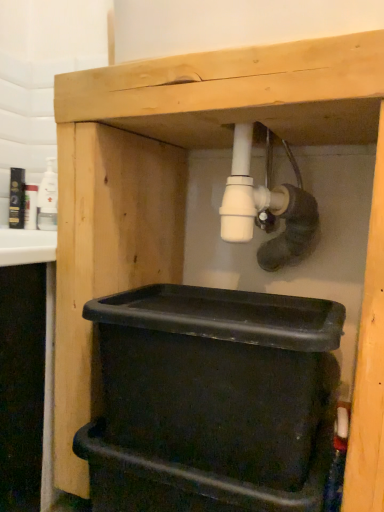
Question: Can you see black plastic bin at lower center touching white glossy bottle at upper left?

Choices:
 (A) no
 (B) yes

Answer: (A)

Question: Is black plastic bin at lower center outside white glossy bottle at upper left?

Choices:
 (A) yes
 (B) no

Answer: (A)

Question: Considering the relative sizes of black plastic bin at lower center and white glossy bottle at upper left in the image provided, is black plastic bin at lower center taller than white glossy bottle at upper left?

Choices:
 (A) no
 (B) yes

Answer: (B)

Question: Is white glossy bottle at upper left at the back of black plastic bin at lower center?

Choices:
 (A) no
 (B) yes

Answer: (A)

Question: Would you consider black plastic bin at lower center to be distant from white glossy bottle at upper left?

Choices:
 (A) no
 (B) yes

Answer: (B)

Question: Is black plastic bin at lower center wider than white glossy bottle at upper left?

Choices:
 (A) no
 (B) yes

Answer: (B)

Question: Is white glossy bottle at upper left surrounding black plastic bin at lower center?

Choices:
 (A) yes
 (B) no

Answer: (B)

Question: From the image's perspective, is white glossy bottle at upper left under black plastic bin at lower center?

Choices:
 (A) yes
 (B) no

Answer: (B)

Question: Is white glossy bottle at upper left closer to the viewer compared to black plastic bin at lower center?

Choices:
 (A) no
 (B) yes

Answer: (A)

Question: Can you confirm if white glossy bottle at upper left is thinner than black plastic bin at lower center?

Choices:
 (A) no
 (B) yes

Answer: (B)

Question: Is white glossy bottle at upper left outside black plastic bin at lower center?

Choices:
 (A) yes
 (B) no

Answer: (A)

Question: Is white glossy bottle at upper left bigger than black plastic bin at lower center?

Choices:
 (A) no
 (B) yes

Answer: (A)

Question: Is point (39, 216) closer or farther from the camera than point (233, 455)?

Choices:
 (A) closer
 (B) farther

Answer: (B)